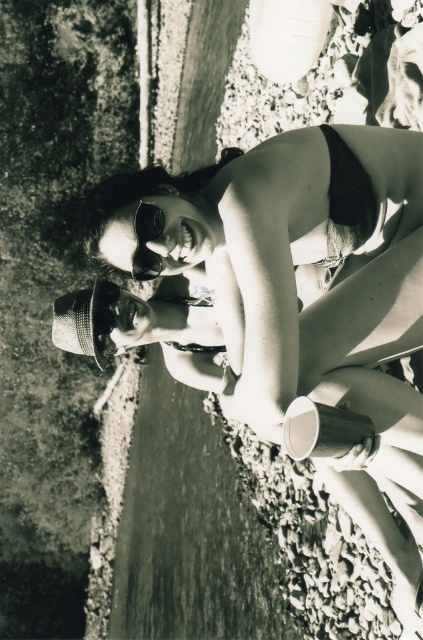
Which is above, matte black bikini at center or matte black goggles at center?

matte black goggles at center

Who is shorter, matte black bikini at center or matte black goggles at center?

Standing shorter between the two is matte black goggles at center.

Is point (362, 326) closer to viewer compared to point (143, 208)?

Yes, it is.

The image size is (423, 640). I want to click on matte black bikini at center, so click(290, 266).